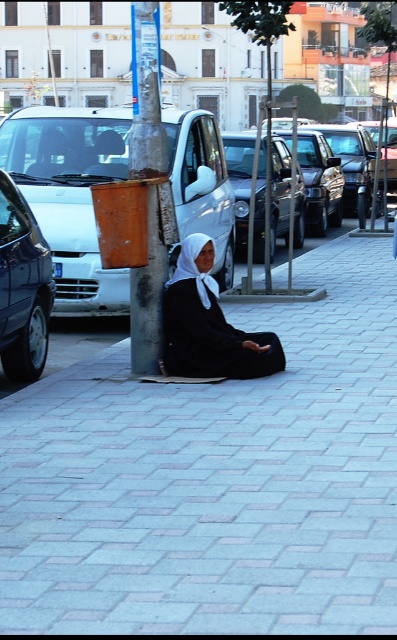
You are a pedestrian standing on the sidewalk. You see the white glossy van at left and the black matte dress at center. Which object is positioned higher in the image?

The white glossy van at left is located above the black matte dress at center, so it is positioned higher in the image.

You are a delivery person trying to avoid stepping on the white fabric headscarf at center while approaching the rusty metal pole at center. Which direction should you move to ensure you don not step on it?

The rusty metal pole at center is positioned over white fabric headscarf at center. To avoid stepping on the white fabric headscarf at center, you should move to the side opposite the direction where the rusty metal pole at center is located since it is above the scarf.

You are a photographer standing at the center of the image. You want to take a photo that includes both the point at coordinates point (158, 300) and point (192, 268). Which point should you focus on to ensure both are in sharp focus?

You should focus on point (192, 268) because it is closer to the camera than point (158, 300). By focusing on the closer point, the depth of field will likely include the farther point as well.